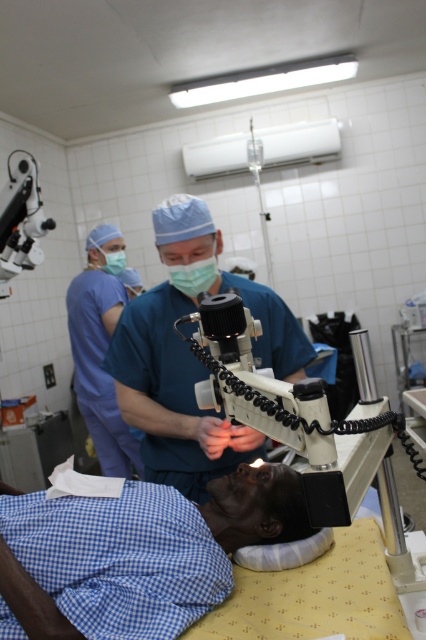
Is blue checkered fabric at lower left wider than matte black microscope at upper left?

Indeed, blue checkered fabric at lower left has a greater width compared to matte black microscope at upper left.

Does point (207, 513) lie in front of point (11, 289)?

Yes, point (207, 513) is closer to viewer.

At what (x,y) coordinates should I click in order to perform the action: click on blue checkered fabric at lower left. Please return your answer as a coordinate pair (x, y). Looking at the image, I should click on (137, 554).

Is white plastic microscope at center below matte black microscope at upper left?

Yes.

Where is `white plastic microscope at center`? white plastic microscope at center is located at coordinates (305, 426).

Who is more forward, (400, 424) or (26, 209)?

Point (400, 424)

Find the location of `white plastic microscope at center`. white plastic microscope at center is located at coordinates (305, 426).

Based on the photo, can you confirm if blue checkered fabric at lower left is smaller than green matte mask at upper left?

Actually, blue checkered fabric at lower left might be larger than green matte mask at upper left.

Looking at this image, between blue checkered fabric at lower left and green matte mask at upper left, which one is positioned higher?

green matte mask at upper left

Find the location of a particular element. blue checkered fabric at lower left is located at coordinates click(137, 554).